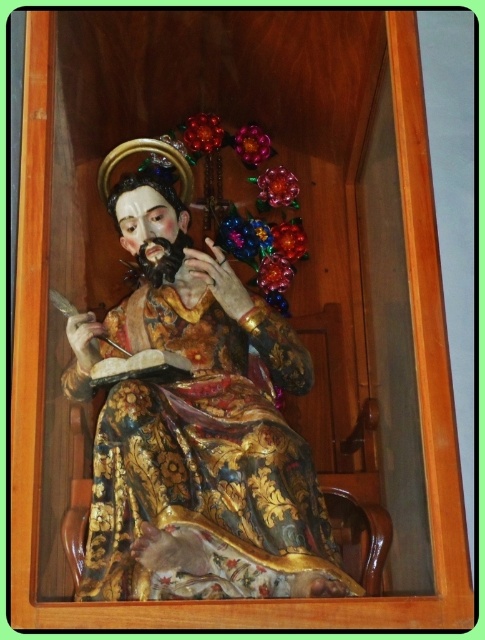
In the scene shown: Can you confirm if gold-painted wood statue at center is wider than matte gold face at center?

Yes, gold-painted wood statue at center is wider than matte gold face at center.

Who is more forward, (208, 323) or (156, 198)?

Point (208, 323) is in front.

Identify the location of gold-painted wood statue at center. (200, 445).